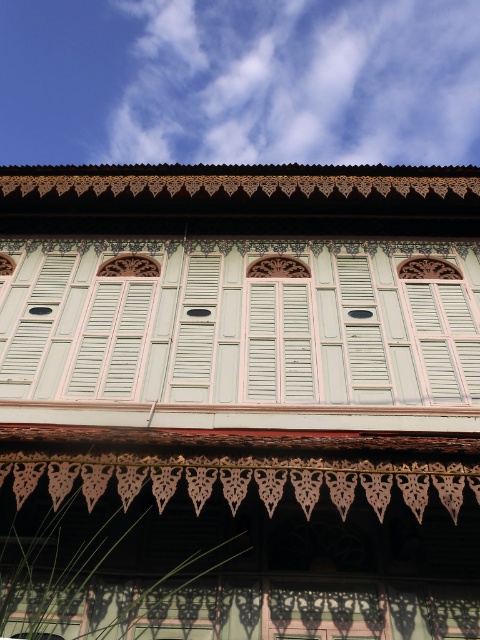
You are an architect designing a model of this building. You need to place a small decorative element exactly at the center of the building facade. The light green wood shutters at center are located at coordinates point 0.506, 0.498. Is this point the center of the building facade?

The light green wood shutters at center are located at point (x=239, y=323), which is very close to the mathematical center of the facade. Since the shutters are described as being at the center, this coordinate likely represents the intended central point of the building facade.